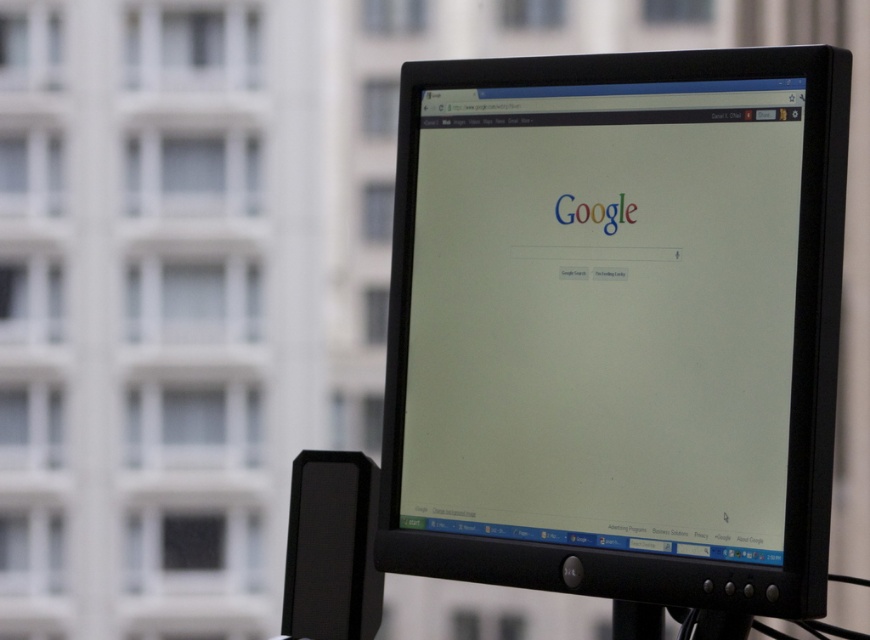
How much distance is there between black plastic monitor at center and black plastic pole at center?

A distance of 6.84 inches exists between black plastic monitor at center and black plastic pole at center.

Between black plastic monitor at center and black plastic pole at center, which one has less height?

black plastic pole at center is shorter.

The height and width of the screenshot is (640, 870). Describe the element at coordinates (617, 324) in the screenshot. I see `black plastic monitor at center` at that location.

Identify the location of black plastic monitor at center. (617, 324).